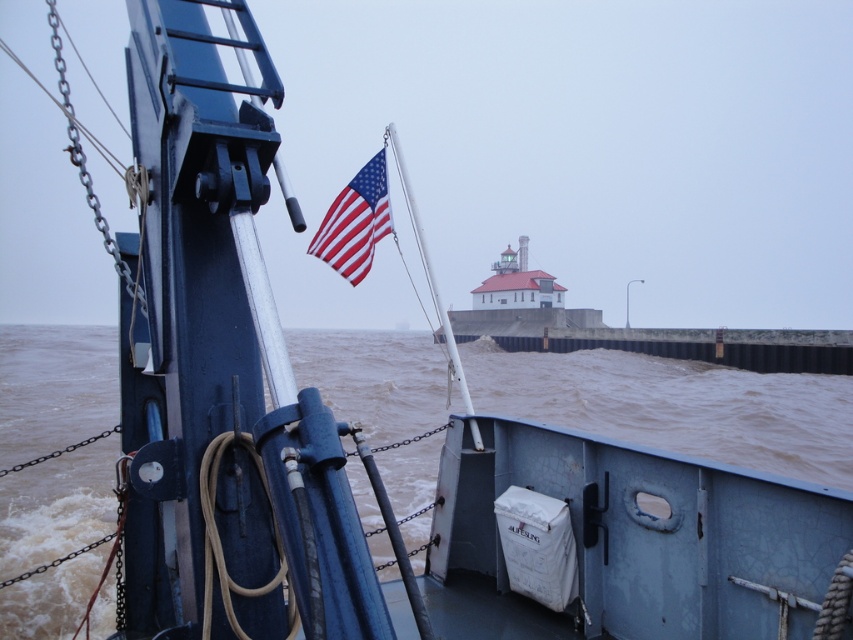
Which is behind, point (830, 406) or point (378, 180)?

Point (830, 406)

Is brown muddy water at lower center taller than red/white striped fabric flag at center?

Indeed, brown muddy water at lower center has a greater height compared to red/white striped fabric flag at center.

The image size is (853, 640). What do you see at coordinates (680, 406) in the screenshot?
I see `brown muddy water at lower center` at bounding box center [680, 406].

You are a GUI agent. You are given a task and a screenshot of the screen. Output one action in this format:
    pyautogui.click(x=<x>, y=<y>)
    Task: Click on the brown muddy water at lower center
    The image size is (853, 640).
    Given the screenshot: What is the action you would take?
    pyautogui.click(x=680, y=406)